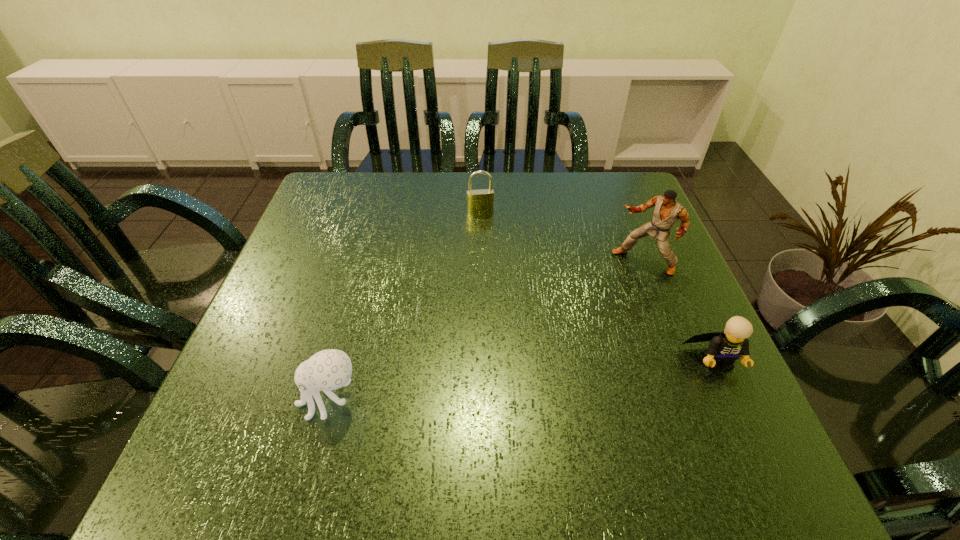
Where is `vacant area located 0.350m on the front-facing side of the padlock`? vacant area located 0.350m on the front-facing side of the padlock is located at coordinates (496, 313).

I want to click on vacant space situated 0.350m on the front-facing side of the padlock, so click(496, 313).

Locate an element on the screen. Image resolution: width=960 pixels, height=540 pixels. vacant space located 0.090m on the front-facing side of the third nearest object is located at coordinates (604, 293).

The image size is (960, 540). In order to click on vacant space located 0.100m on the front-facing side of the third nearest object in this screenshot , I will do `click(601, 296)`.

Locate an element on the screen. This screenshot has width=960, height=540. vacant point located on the front-facing side of the third nearest object is located at coordinates (564, 329).

You are a GUI agent. You are given a task and a screenshot of the screen. Output one action in this format:
    pyautogui.click(x=<x>, y=<y>)
    Task: Click on the object located in the far edge section of the desktop
    Image resolution: width=960 pixels, height=540 pixels.
    Given the screenshot: What is the action you would take?
    pyautogui.click(x=478, y=201)

Identify the location of object present at the near edge. The height and width of the screenshot is (540, 960). (331, 369).

Locate an element on the screen. object present at the left edge is located at coordinates (331, 369).

Locate an element on the screen. The width and height of the screenshot is (960, 540). Lego positioned at the right edge is located at coordinates (725, 347).

Locate an element on the screen. puncher present at the right edge is located at coordinates (667, 211).